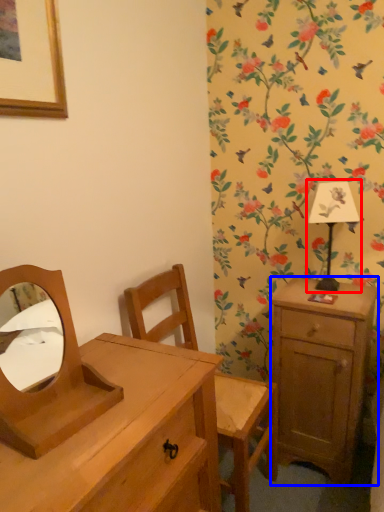
Question: Among these objects, which one is farthest to the camera, bedside lamp (highlighted by a red box) or nightstand (highlighted by a blue box)?

Choices:
 (A) bedside lamp
 (B) nightstand

Answer: (A)